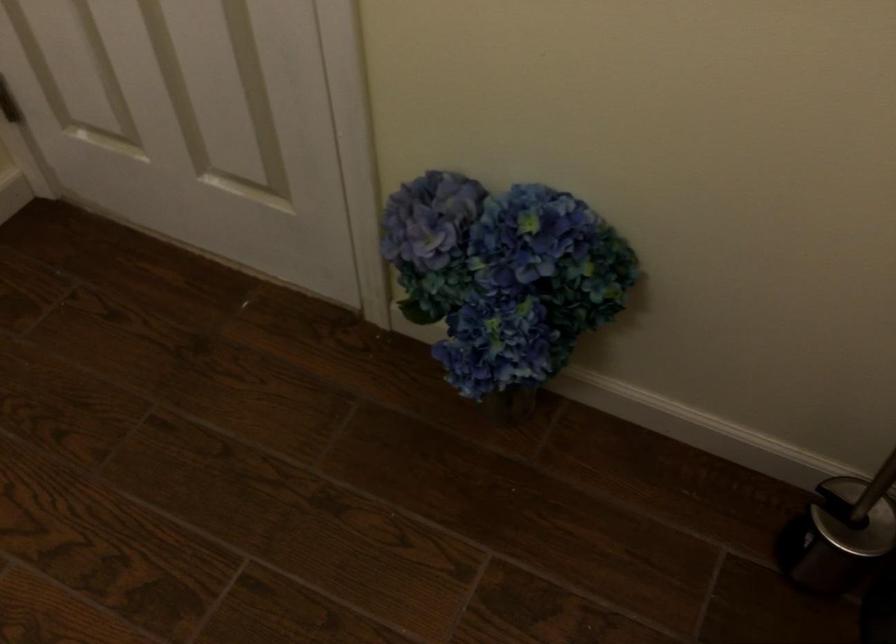
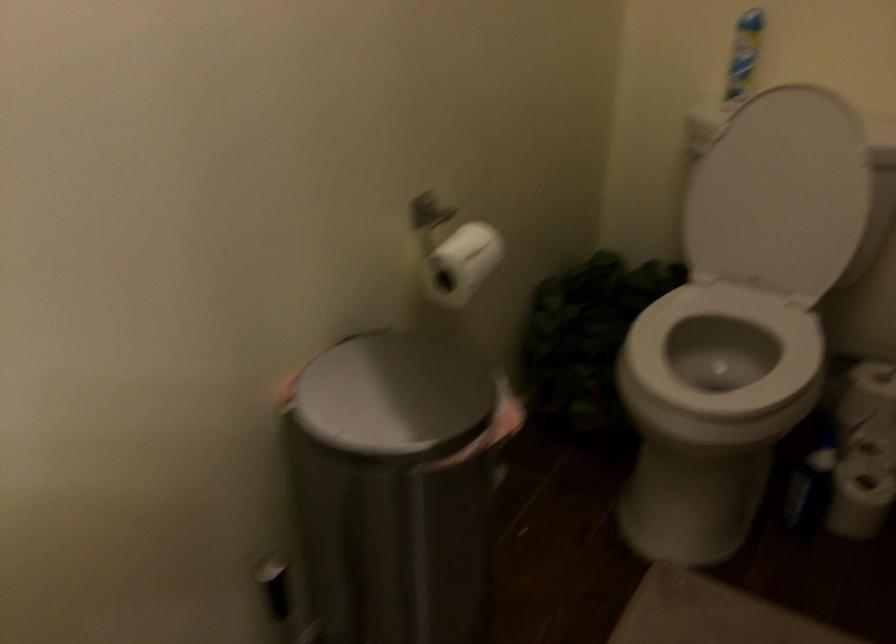
Question: The camera is either moving clockwise (left) or counter-clockwise (right) around the object. The first image is from the beginning of the video and the second image is from the end. Is the camera moving left or right when shooting the video?

Choices:
 (A) Left
 (B) Right

Answer: (A)